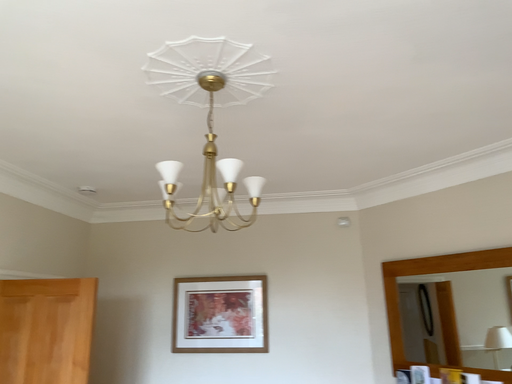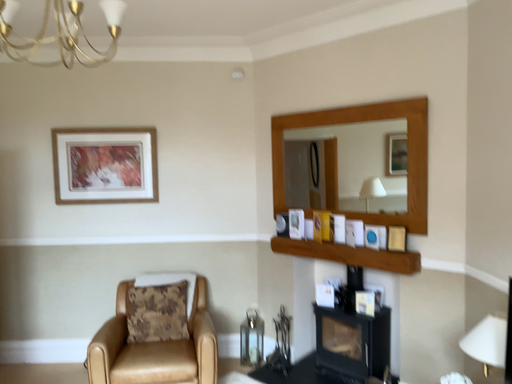
Question: Which way did the camera rotate in the video?

Choices:
 (A) rotated right
 (B) rotated left

Answer: (A)